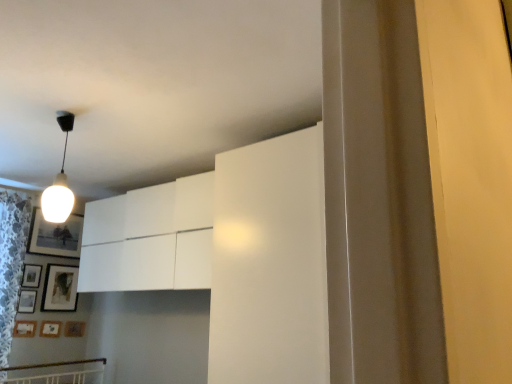
Question: Could you tell me if wooden picture frame at lower left, which ranks as the sixth picture frame in top-to-bottom order, is facing matte black picture frame at lower left, placed as the 5th picture frame when sorted from bottom to top?

Choices:
 (A) yes
 (B) no

Answer: (B)

Question: From the image's perspective, is wooden picture frame at lower left, which ranks as the sixth picture frame in top-to-bottom order, located beneath matte black picture frame at lower left, placed as the 5th picture frame when sorted from bottom to top?

Choices:
 (A) no
 (B) yes

Answer: (B)

Question: Does wooden picture frame at lower left, which ranks as the sixth picture frame in top-to-bottom order, lie behind matte black picture frame at lower left, placed as the 5th picture frame when sorted from bottom to top?

Choices:
 (A) yes
 (B) no

Answer: (B)

Question: Does wooden picture frame at lower left, arranged as the 2th picture frame when ordered from the bottom, have a larger size compared to matte black picture frame at lower left, which ranks as the 3th picture frame in top-to-bottom order?

Choices:
 (A) no
 (B) yes

Answer: (A)

Question: Is matte black picture frame at lower left, which ranks as the 3th picture frame in top-to-bottom order, a part of wooden picture frame at lower left, arranged as the 2th picture frame when ordered from the bottom?

Choices:
 (A) yes
 (B) no

Answer: (B)

Question: Does wooden picture frame at lower left, arranged as the 2th picture frame when ordered from the bottom, lie in front of matte black picture frame at lower left, which ranks as the 3th picture frame in top-to-bottom order?

Choices:
 (A) no
 (B) yes

Answer: (B)

Question: Does wooden matte picture frame at lower left, the 3th picture frame positioned from the bottom, have a greater height compared to wooden picture frame at lower left, placed as the 2th picture frame when sorted from top to bottom?

Choices:
 (A) no
 (B) yes

Answer: (A)

Question: Is wooden matte picture frame at lower left, which is the 5th picture frame in top-to-bottom order, smaller than wooden picture frame at lower left, the 6th picture frame positioned from the bottom?

Choices:
 (A) yes
 (B) no

Answer: (A)

Question: Would you consider wooden matte picture frame at lower left, the 3th picture frame positioned from the bottom, to be distant from wooden picture frame at lower left, the 6th picture frame positioned from the bottom?

Choices:
 (A) yes
 (B) no

Answer: (B)

Question: Is the depth of wooden matte picture frame at lower left, which is the 5th picture frame in top-to-bottom order, less than that of wooden picture frame at lower left, placed as the 2th picture frame when sorted from top to bottom?

Choices:
 (A) yes
 (B) no

Answer: (A)

Question: Is wooden matte picture frame at lower left, the 3th picture frame positioned from the bottom, thinner than wooden picture frame at lower left, the 6th picture frame positioned from the bottom?

Choices:
 (A) yes
 (B) no

Answer: (A)

Question: Considering the relative positions of wooden matte picture frame at lower left, which is the 5th picture frame in top-to-bottom order, and wooden picture frame at lower left, the 6th picture frame positioned from the bottom, in the image provided, is wooden matte picture frame at lower left, which is the 5th picture frame in top-to-bottom order, behind wooden picture frame at lower left, the 6th picture frame positioned from the bottom,?

Choices:
 (A) yes
 (B) no

Answer: (B)

Question: Is matte black picture frame at upper left, acting as the first picture frame starting from the top, oriented away from white glossy light bulb at upper left?

Choices:
 (A) yes
 (B) no

Answer: (B)